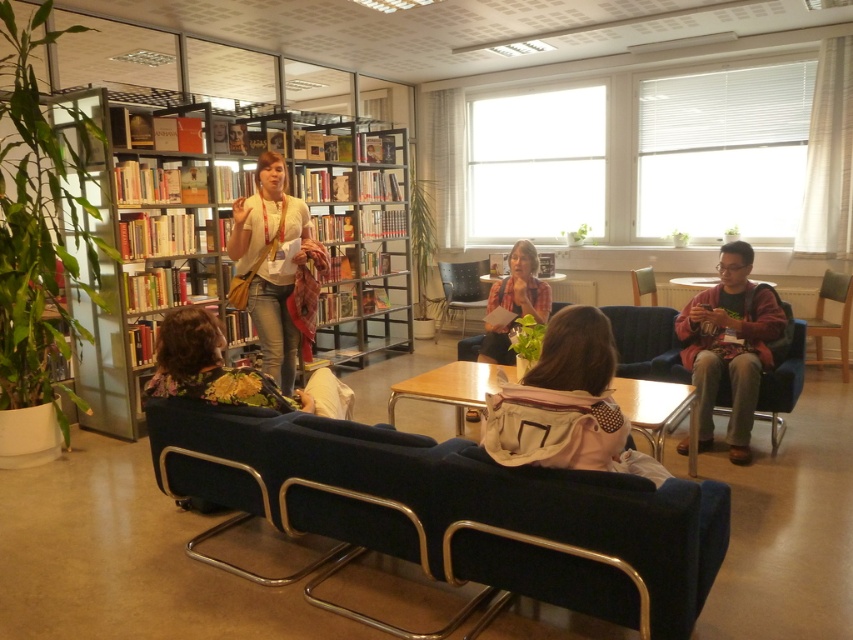
Question: Which object appears farthest from the camera in this image?

Choices:
 (A) beige fabric backpack at center
 (B) matte gold armchair at center
 (C) wooden table at center

Answer: (C)

Question: Does velvet dark blue couch at center lie behind brown fabric jacket at right?

Choices:
 (A) no
 (B) yes

Answer: (A)

Question: Which of these objects is positioned closest to the velvet dark blue couch at center?

Choices:
 (A) light brown wooden table at center
 (B) beige fabric backpack at center
 (C) brown fabric jacket at right
 (D) metallic silver armchair at center

Answer: (B)

Question: Which object appears closest to the camera in this image?

Choices:
 (A) light brown wooden table at center
 (B) wooden table at center
 (C) metallic silver bookcase at center
 (D) metallic silver armchair at center

Answer: (A)

Question: Does white matte shirt at center have a lesser width compared to wooden table at center?

Choices:
 (A) no
 (B) yes

Answer: (A)

Question: Observing the image, what is the correct spatial positioning of plaid shirt at center in reference to wooden table at center?

Choices:
 (A) below
 (B) above

Answer: (A)